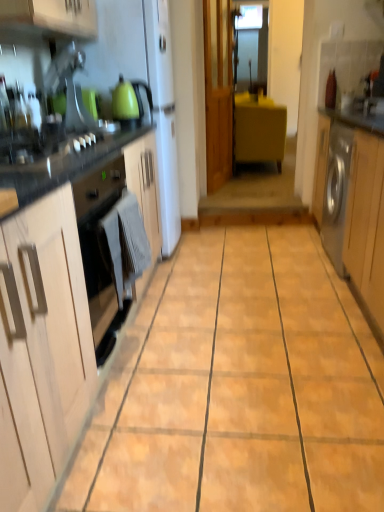
Question: From the image's perspective, is gray fabric towel at lower left beneath yellow matte cabinet at center, acting as the second cabinetry starting from the right?

Choices:
 (A) yes
 (B) no

Answer: (A)

Question: From a real-world perspective, is gray fabric towel at lower left on yellow matte cabinet at center, acting as the second cabinetry starting from the right?

Choices:
 (A) no
 (B) yes

Answer: (A)

Question: Is gray fabric towel at lower left bigger than yellow matte cabinet at center, which is the 1th cabinetry from top to bottom?

Choices:
 (A) yes
 (B) no

Answer: (B)

Question: Does gray fabric towel at lower left have a lesser height compared to yellow matte cabinet at center, which is the 1th cabinetry from top to bottom?

Choices:
 (A) yes
 (B) no

Answer: (A)

Question: Is gray fabric towel at lower left at the left side of yellow matte cabinet at center, the first cabinetry viewed from the back?

Choices:
 (A) no
 (B) yes

Answer: (B)

Question: Is gray fabric towel at lower left in front of or behind light wood cabinet at left, the third cabinetry viewed from the right, in the image?

Choices:
 (A) front
 (B) behind

Answer: (B)

Question: Is gray fabric towel at lower left situated inside light wood cabinet at left, the third cabinetry positioned from the back, or outside?

Choices:
 (A) inside
 (B) outside

Answer: (B)

Question: In terms of width, does gray fabric towel at lower left look wider or thinner when compared to light wood cabinet at left, which appears as the 1th cabinetry when viewed from the front?

Choices:
 (A) wide
 (B) thin

Answer: (B)

Question: From the image's perspective, is gray fabric towel at lower left above or below light wood cabinet at left, which is the 1th cabinetry from left to right?

Choices:
 (A) above
 (B) below

Answer: (A)

Question: Relative to light wood cabinet at left, the third cabinetry viewed from the right, is silver metallic washing machine at right, the 2th cabinetry ordered from the bottom, in front or behind?

Choices:
 (A) behind
 (B) front

Answer: (A)

Question: Is silver metallic washing machine at right, the second cabinetry viewed from the back, situated inside light wood cabinet at left, which appears as the first cabinetry when ordered from the bottom, or outside?

Choices:
 (A) outside
 (B) inside

Answer: (A)

Question: Considering the positions of point (334, 114) and point (64, 412), is point (334, 114) closer or farther from the camera than point (64, 412)?

Choices:
 (A) closer
 (B) farther

Answer: (B)

Question: Considering the relative positions of silver metallic washing machine at right, which is counted as the first cabinetry, starting from the right, and light wood cabinet at left, the third cabinetry viewed from the right, in the image provided, is silver metallic washing machine at right, which is counted as the first cabinetry, starting from the right, to the left or to the right of light wood cabinet at left, the third cabinetry viewed from the right,?

Choices:
 (A) left
 (B) right

Answer: (B)

Question: In terms of width, does light wood cabinet at left, which appears as the 1th cabinetry when viewed from the front, look wider or thinner when compared to matte green kettle at upper left?

Choices:
 (A) wide
 (B) thin

Answer: (A)

Question: From a real-world perspective, is light wood cabinet at left, marked as the third cabinetry in a top-to-bottom arrangement, positioned above or below matte green kettle at upper left?

Choices:
 (A) above
 (B) below

Answer: (B)